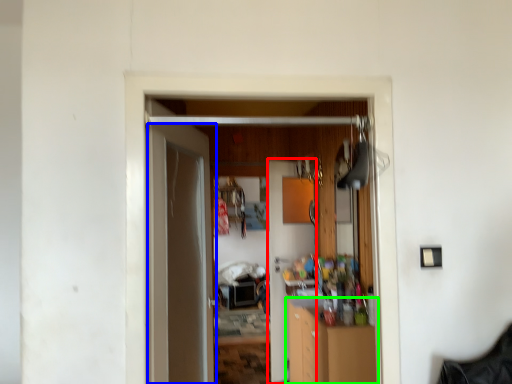
Question: Estimate the real-world distances between objects in this image. Which object is farther from door (highlighted by a red box), door (highlighted by a blue box) or cabinetry (highlighted by a green box)?

Choices:
 (A) door
 (B) cabinetry

Answer: (A)